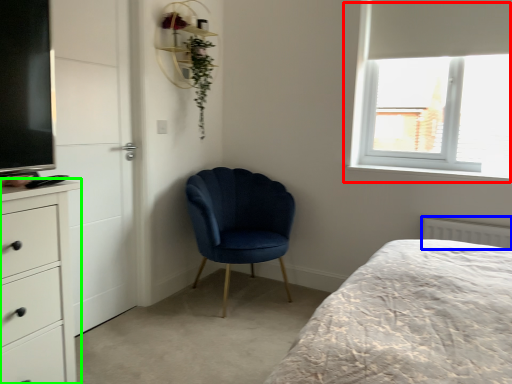
Question: Which object is the farthest from window (highlighted by a red box)? Choose among these: radiator (highlighted by a blue box) or chest of drawers (highlighted by a green box).

Choices:
 (A) radiator
 (B) chest of drawers

Answer: (B)